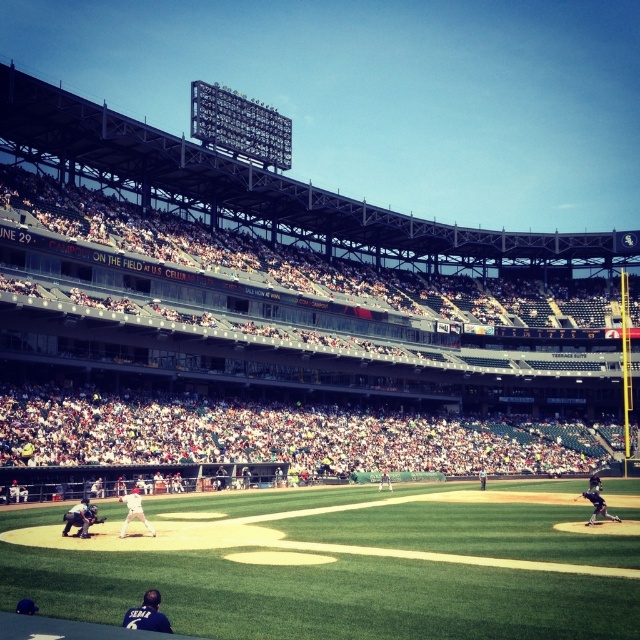
Identify the location of dark blue jersey at lower center. This screenshot has width=640, height=640. (147, 614).

Is point (131, 612) closer to camera compared to point (593, 522)?

Yes.

Is point (125, 625) positioned in front of point (596, 488)?

Yes, point (125, 625) is closer to viewer.

Identify the location of dark blue jersey at lower center. The width and height of the screenshot is (640, 640). (147, 614).

Who is higher up, white uniform at center or white uniformed umpire at center?

Positioned higher is white uniform at center.

In the scene shown: Can you confirm if white uniform at center is bigger than white uniformed umpire at center?

Yes, white uniform at center is bigger than white uniformed umpire at center.

Where is `white uniform at center`? The height and width of the screenshot is (640, 640). white uniform at center is located at coordinates (132, 512).

You are a GUI agent. You are given a task and a screenshot of the screen. Output one action in this format:
    pyautogui.click(x=<x>, y=<y>)
    Task: Click on the white uniform at center
    The width and height of the screenshot is (640, 640).
    Given the screenshot: What is the action you would take?
    point(132,512)

Which of these two, green grass baseball field at center or black uniform at center, stands shorter?

With less height is green grass baseball field at center.

Is green grass baseball field at center behind black uniform at center?

No, green grass baseball field at center is in front of black uniform at center.

Does point (74, 605) lie in front of point (595, 484)?

Yes.

Locate an element on the screen. green grass baseball field at center is located at coordinates (342, 563).